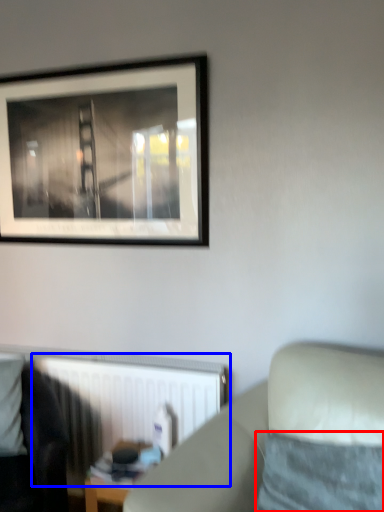
Question: Which object appears closest to the camera in this image, pillow (highlighted by a red box) or radiator (highlighted by a blue box)?

Choices:
 (A) pillow
 (B) radiator

Answer: (A)